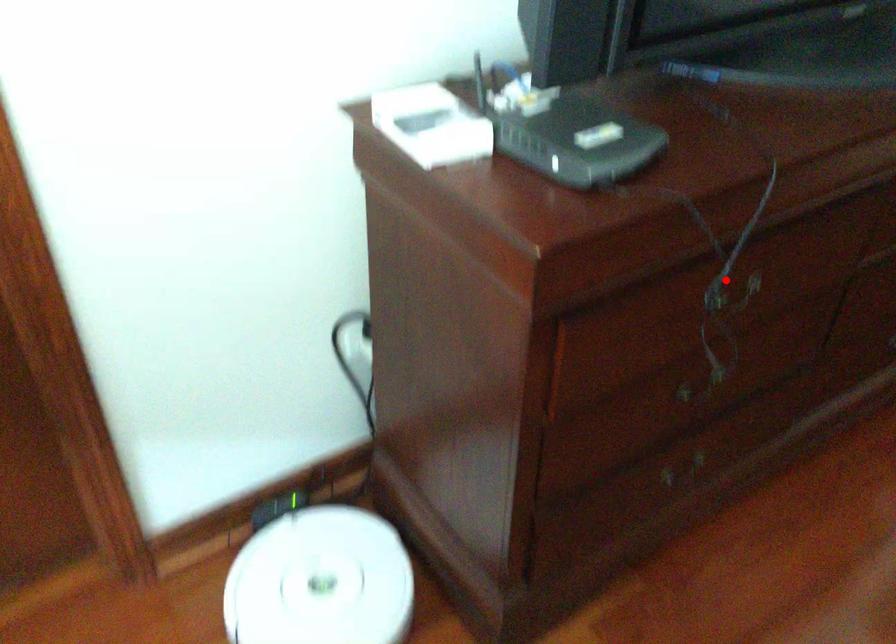
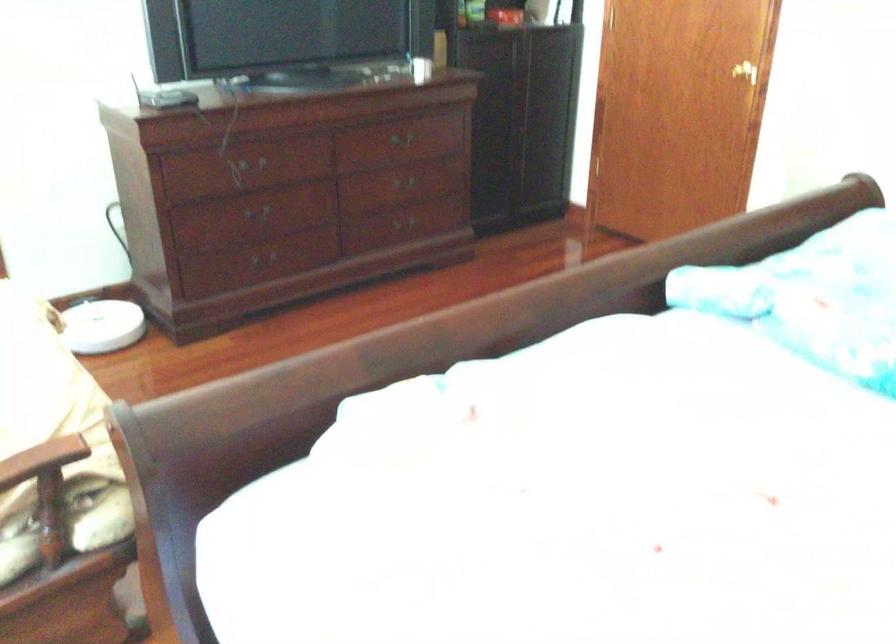
In the second image, find the point that corresponds to the highlighted location in the first image.

(255, 164)